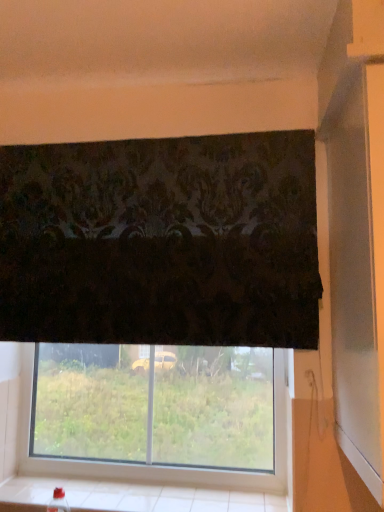
Identify the location of empty space that is ontop of white tile at lower center (from a real-world perspective). (100, 490).